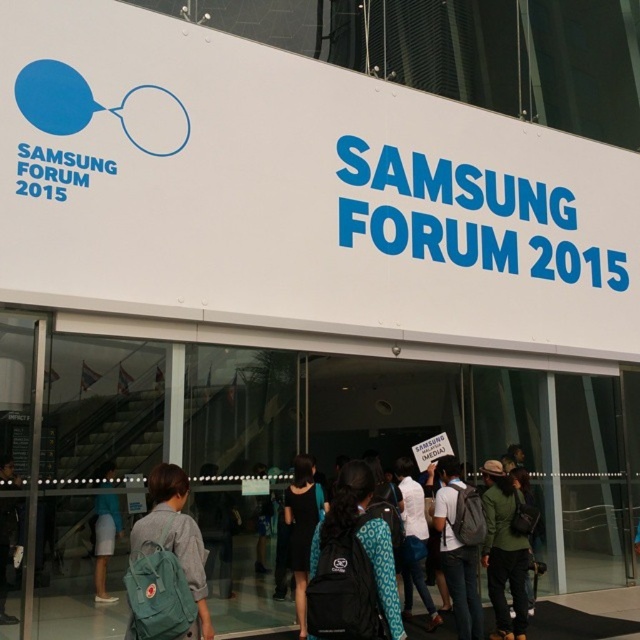
Is green matte jacket at center to the left of black fabric dress at center from the viewer's perspective?

Incorrect, green matte jacket at center is not on the left side of black fabric dress at center.

Which is above, green matte jacket at center or black fabric dress at center?

green matte jacket at center

Image resolution: width=640 pixels, height=640 pixels. Describe the element at coordinates (504, 552) in the screenshot. I see `green matte jacket at center` at that location.

Where is `green matte jacket at center`? The height and width of the screenshot is (640, 640). green matte jacket at center is located at coordinates (504, 552).

Can you confirm if green matte jacket at center is positioned to the left of white cotton shirt at center?

In fact, green matte jacket at center is to the right of white cotton shirt at center.

Between point (486, 540) and point (433, 604), which one is positioned in front?

Point (486, 540) is more forward.

Locate an element on the screen. The width and height of the screenshot is (640, 640). green matte jacket at center is located at coordinates (504, 552).

Is teal backpack at center wider than green matte jacket at center?

Correct, the width of teal backpack at center exceeds that of green matte jacket at center.

The height and width of the screenshot is (640, 640). In order to click on teal backpack at center in this screenshot , I will do `click(166, 564)`.